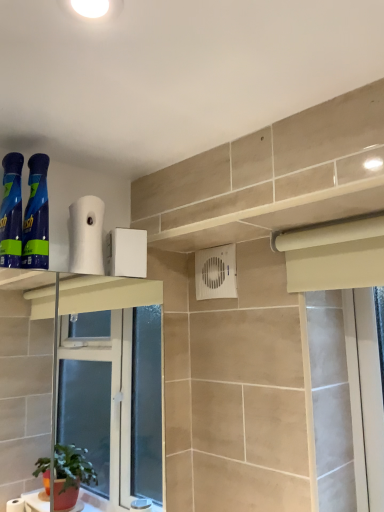
The width and height of the screenshot is (384, 512). I want to click on white plastic air conditioning unit at center, so click(x=216, y=273).

This screenshot has width=384, height=512. What do you see at coordinates (11, 212) in the screenshot?
I see `blue glossy spray can at left, which ranks as the 2th cleaning product in right-to-left order` at bounding box center [11, 212].

What are the coordinates of `blue glossy spray bottles at left, acting as the second cleaning product starting from the left` in the screenshot? It's located at (36, 216).

Describe the element at coordinates (36, 216) in the screenshot. I see `blue glossy spray bottles at left, which ranks as the first cleaning product in right-to-left order` at that location.

Where is `white plastic air conditioning unit at center`? white plastic air conditioning unit at center is located at coordinates (216, 273).

How far apart are white matte toilet paper at upper center and blue glossy spray bottles at left, which ranks as the first cleaning product in right-to-left order?

white matte toilet paper at upper center and blue glossy spray bottles at left, which ranks as the first cleaning product in right-to-left order, are 4.11 inches apart.

Considering their positions, is white matte toilet paper at upper center located in front of or behind blue glossy spray bottles at left, which ranks as the first cleaning product in right-to-left order?

white matte toilet paper at upper center is positioned farther from the viewer than blue glossy spray bottles at left, which ranks as the first cleaning product in right-to-left order.

Is white matte toilet paper at upper center situated inside blue glossy spray bottles at left, acting as the second cleaning product starting from the left, or outside?

white matte toilet paper at upper center is outside blue glossy spray bottles at left, acting as the second cleaning product starting from the left.

You are a GUI agent. You are given a task and a screenshot of the screen. Output one action in this format:
    pyautogui.click(x=<x>, y=<y>)
    Task: Click on the toilet paper behind the blue glossy spray bottles at left, which ranks as the first cleaning product in right-to-left order
    
    Given the screenshot: What is the action you would take?
    pyautogui.click(x=86, y=234)

Is blue glossy spray bottles at left, which ranks as the first cleaning product in right-to-left order, positioned far away from white plastic air conditioning unit at center?

Actually, blue glossy spray bottles at left, which ranks as the first cleaning product in right-to-left order, and white plastic air conditioning unit at center are a little close together.

Looking at their sizes, would you say blue glossy spray bottles at left, acting as the second cleaning product starting from the left, is wider or thinner than white plastic air conditioning unit at center?

Clearly, blue glossy spray bottles at left, acting as the second cleaning product starting from the left, has more width compared to white plastic air conditioning unit at center.

Based on the photo, which object is further away from the camera taking this photo, blue glossy spray bottles at left, acting as the second cleaning product starting from the left, or white plastic air conditioning unit at center?

white plastic air conditioning unit at center.

From the image's perspective, is white matte toilet paper at upper center located beneath blue glossy spray can at left, which ranks as the 2th cleaning product in right-to-left order?

Indeed, from the image's perspective, white matte toilet paper at upper center is shown beneath blue glossy spray can at left, which ranks as the 2th cleaning product in right-to-left order.

Who is taller, white matte toilet paper at upper center or blue glossy spray can at left, which ranks as the 2th cleaning product in right-to-left order?

blue glossy spray can at left, which ranks as the 2th cleaning product in right-to-left order, is taller.

Considering the sizes of objects white matte toilet paper at upper center and blue glossy spray can at left, which ranks as the 2th cleaning product in right-to-left order, in the image provided, who is smaller, white matte toilet paper at upper center or blue glossy spray can at left, which ranks as the 2th cleaning product in right-to-left order,?

blue glossy spray can at left, which ranks as the 2th cleaning product in right-to-left order, is smaller.

Is the depth of white matte toilet paper at upper center greater than that of blue glossy spray can at left, placed as the first cleaning product when sorted from left to right?

Yes.

Considering the sizes of objects blue glossy spray can at left, placed as the first cleaning product when sorted from left to right, and blue glossy spray bottles at left, which ranks as the first cleaning product in right-to-left order, in the image provided, who is taller, blue glossy spray can at left, placed as the first cleaning product when sorted from left to right, or blue glossy spray bottles at left, which ranks as the first cleaning product in right-to-left order,?

With more height is blue glossy spray can at left, placed as the first cleaning product when sorted from left to right.

From the picture: Is blue glossy spray can at left, which ranks as the 2th cleaning product in right-to-left order, oriented towards blue glossy spray bottles at left, which ranks as the first cleaning product in right-to-left order?

No, blue glossy spray can at left, which ranks as the 2th cleaning product in right-to-left order, does not turn towards blue glossy spray bottles at left, which ranks as the first cleaning product in right-to-left order.

From a real-world perspective, is blue glossy spray can at left, which ranks as the 2th cleaning product in right-to-left order, physically above blue glossy spray bottles at left, which ranks as the first cleaning product in right-to-left order?

Indeed, from a real-world perspective, blue glossy spray can at left, which ranks as the 2th cleaning product in right-to-left order, stands above blue glossy spray bottles at left, which ranks as the first cleaning product in right-to-left order.

This screenshot has width=384, height=512. I want to click on cleaning product on the left of blue glossy spray bottles at left, acting as the second cleaning product starting from the left, so click(x=11, y=212).

Is the position of white matte toilet paper at upper center less distant than that of white plastic air conditioning unit at center?

Yes.

Consider the image. Considering the relative sizes of white matte toilet paper at upper center and white plastic air conditioning unit at center in the image provided, is white matte toilet paper at upper center wider than white plastic air conditioning unit at center?

Yes.

Can you confirm if white matte toilet paper at upper center is positioned to the right of white plastic air conditioning unit at center?

No.

The width and height of the screenshot is (384, 512). I want to click on toilet paper in front of the white plastic air conditioning unit at center, so click(86, 234).

Is blue glossy spray bottles at left, which ranks as the first cleaning product in right-to-left order, positioned in front of white matte toilet paper at upper center?

Yes.

Does blue glossy spray bottles at left, acting as the second cleaning product starting from the left, turn towards white matte toilet paper at upper center?

No, blue glossy spray bottles at left, acting as the second cleaning product starting from the left, does not turn towards white matte toilet paper at upper center.

Which is less distant, (x=34, y=164) or (x=102, y=211)?

Point (x=34, y=164) appears to be closer to the viewer than point (x=102, y=211).

Do you think blue glossy spray can at left, placed as the first cleaning product when sorted from left to right, is within white plastic air conditioning unit at center, or outside of it?

blue glossy spray can at left, placed as the first cleaning product when sorted from left to right, is spatially situated outside white plastic air conditioning unit at center.

Does blue glossy spray can at left, which ranks as the 2th cleaning product in right-to-left order, have a greater height compared to white plastic air conditioning unit at center?

Correct, blue glossy spray can at left, which ranks as the 2th cleaning product in right-to-left order, is much taller as white plastic air conditioning unit at center.

From the white plastic air conditioning unit at center, count the 2nd cleaning product to the left and point to it. Please provide its 2D coordinates.

[(11, 212)]

You are a GUI agent. You are given a task and a screenshot of the screen. Output one action in this format:
    pyautogui.click(x=<x>, y=<y>)
    Task: Click on the toilet paper below the blue glossy spray bottles at left, acting as the second cleaning product starting from the left (from a real-world perspective)
    
    Given the screenshot: What is the action you would take?
    pyautogui.click(x=86, y=234)

In order to click on air conditioning lying behind the blue glossy spray bottles at left, which ranks as the first cleaning product in right-to-left order in this screenshot , I will do `click(216, 273)`.

Estimate the real-world distances between objects in this image. Which object is further from blue glossy spray bottles at left, which ranks as the first cleaning product in right-to-left order, white plastic air conditioning unit at center or white matte toilet paper at upper center?

Among the two, white plastic air conditioning unit at center is located further to blue glossy spray bottles at left, which ranks as the first cleaning product in right-to-left order.

Based on their spatial positions, is white matte toilet paper at upper center or blue glossy spray bottles at left, which ranks as the first cleaning product in right-to-left order, further from blue glossy spray can at left, placed as the first cleaning product when sorted from left to right?

white matte toilet paper at upper center is further to blue glossy spray can at left, placed as the first cleaning product when sorted from left to right.

Considering their positions, is blue glossy spray bottles at left, acting as the second cleaning product starting from the left, positioned further to blue glossy spray can at left, placed as the first cleaning product when sorted from left to right, than white matte toilet paper at upper center?

Based on the image, white matte toilet paper at upper center appears to be further to blue glossy spray can at left, placed as the first cleaning product when sorted from left to right.

Considering their positions, is white matte toilet paper at upper center positioned further to blue glossy spray bottles at left, which ranks as the first cleaning product in right-to-left order, than white plastic air conditioning unit at center?

Based on the image, white plastic air conditioning unit at center appears to be further to blue glossy spray bottles at left, which ranks as the first cleaning product in right-to-left order.

In the scene shown: Based on their spatial positions, is blue glossy spray bottles at left, which ranks as the first cleaning product in right-to-left order, or blue glossy spray can at left, placed as the first cleaning product when sorted from left to right, further from white matte toilet paper at upper center?

blue glossy spray can at left, placed as the first cleaning product when sorted from left to right, lies further to white matte toilet paper at upper center than the other object.

Looking at the image, which one is located further to white plastic air conditioning unit at center, white matte toilet paper at upper center or blue glossy spray bottles at left, acting as the second cleaning product starting from the left?

blue glossy spray bottles at left, acting as the second cleaning product starting from the left, is positioned further to the anchor white plastic air conditioning unit at center.

Considering their positions, is blue glossy spray can at left, placed as the first cleaning product when sorted from left to right, positioned closer to white plastic air conditioning unit at center than blue glossy spray bottles at left, which ranks as the first cleaning product in right-to-left order?

blue glossy spray bottles at left, which ranks as the first cleaning product in right-to-left order, is closer to white plastic air conditioning unit at center.

Which object lies further to the anchor point blue glossy spray can at left, placed as the first cleaning product when sorted from left to right, blue glossy spray bottles at left, which ranks as the first cleaning product in right-to-left order, or white plastic air conditioning unit at center?

white plastic air conditioning unit at center is further to blue glossy spray can at left, placed as the first cleaning product when sorted from left to right.

Find the location of a particular element. This screenshot has width=384, height=512. cleaning product between blue glossy spray can at left, placed as the first cleaning product when sorted from left to right, and white matte toilet paper at upper center, in the horizontal direction is located at coordinates [36, 216].

Locate an element on the screen. toilet paper between blue glossy spray bottles at left, which ranks as the first cleaning product in right-to-left order, and white plastic air conditioning unit at center, in the horizontal direction is located at coordinates tap(86, 234).

I want to click on toilet paper between blue glossy spray can at left, which ranks as the 2th cleaning product in right-to-left order, and white plastic air conditioning unit at center, in the horizontal direction, so click(x=86, y=234).

Locate an element on the screen. Image resolution: width=384 pixels, height=512 pixels. cleaning product between blue glossy spray can at left, which ranks as the 2th cleaning product in right-to-left order, and white plastic air conditioning unit at center is located at coordinates (36, 216).